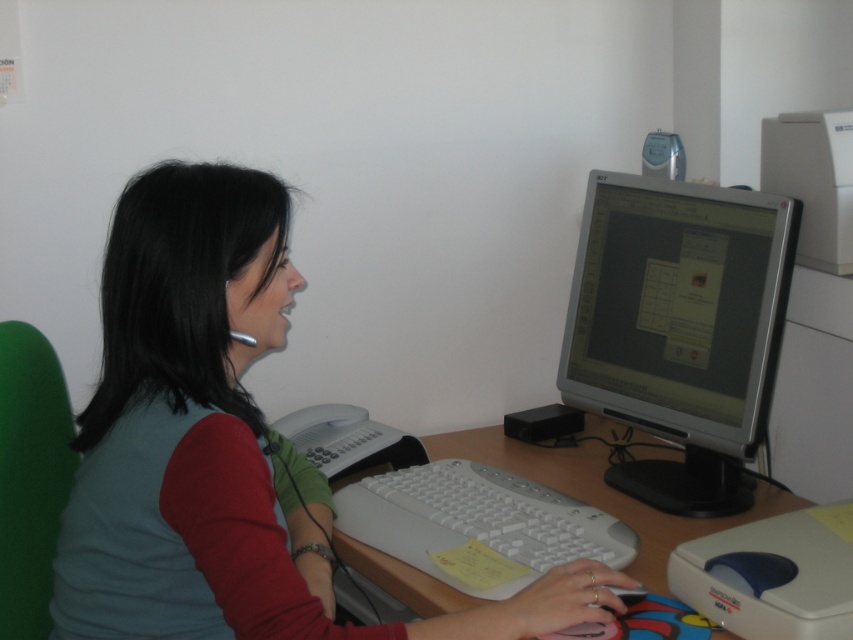
Question: Is matte green shirt at center in front of white plastic computer desk at center?

Choices:
 (A) no
 (B) yes

Answer: (B)

Question: Which point is farther to the camera?

Choices:
 (A) white plastic keyboard at center
 (B) white plastic computer desk at center
 (C) matte green shirt at center

Answer: (A)

Question: Is matte green shirt at center thinner than white plastic keyboard at center?

Choices:
 (A) yes
 (B) no

Answer: (B)

Question: Which object appears farthest from the camera in this image?

Choices:
 (A) white plastic computer desk at center
 (B) white plastic keyboard at center
 (C) silver/black plastic monitor at center-right
 (D) matte green shirt at center

Answer: (C)

Question: Which point is farther from the camera taking this photo?

Choices:
 (A) (677, 412)
 (B) (601, 516)
 (C) (138, 465)
 (D) (776, 496)

Answer: (D)

Question: Is matte green shirt at center thinner than silver/black plastic monitor at center-right?

Choices:
 (A) yes
 (B) no

Answer: (B)